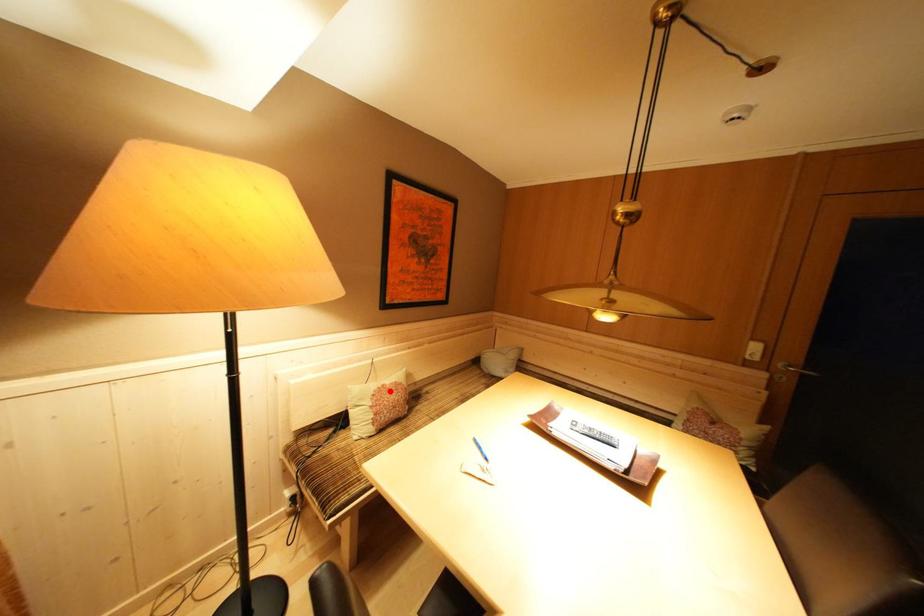
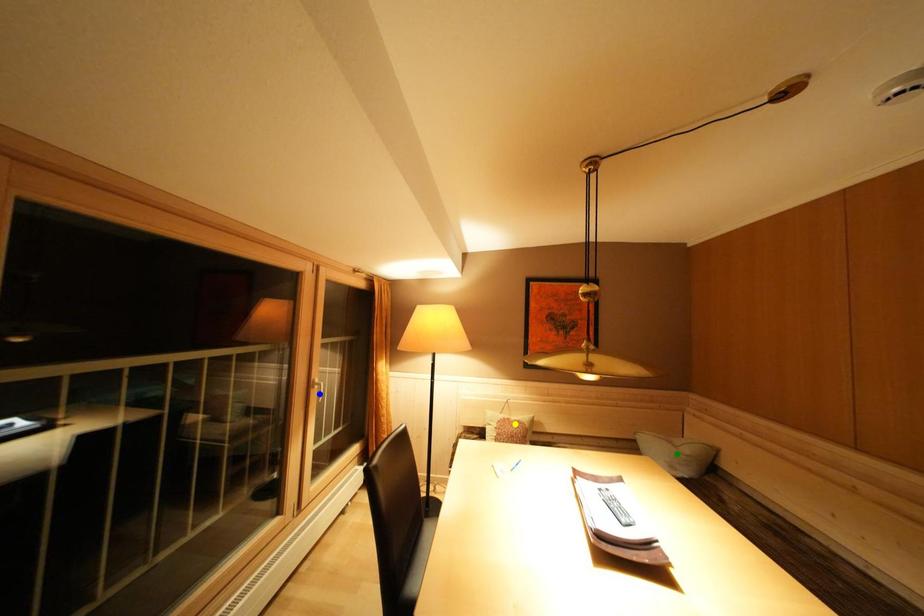
Question: I am providing you with two images of the same scene from different viewpoints. A red point is marked on the first image. You are given multiple points on the second image. Can you choose the point in image 2 that corresponds to the point in image 1?

Choices:
 (A) yellow point
 (B) blue point
 (C) green point

Answer: (A)